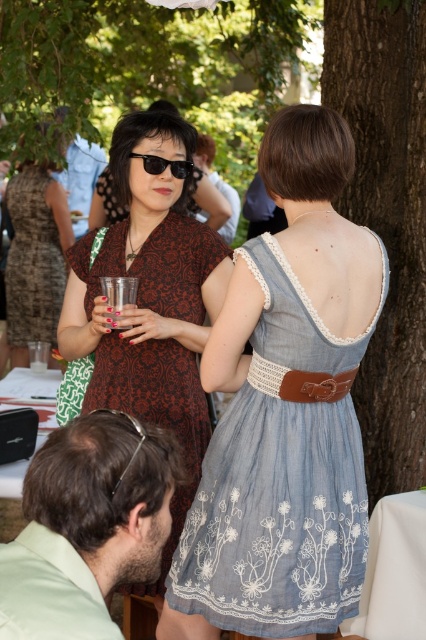
From the picture: Which is above, light green shirt at lower left or clear plastic cup at center?

clear plastic cup at center is above.

In the scene shown: Can you confirm if light green shirt at lower left is positioned to the left of clear plastic cup at center?

In fact, light green shirt at lower left is to the right of clear plastic cup at center.

Does point (100, 598) come farther from viewer compared to point (117, 300)?

No, it is in front of (117, 300).

Identify the location of light green shirt at lower left. (88, 525).

Which is in front, point (54, 189) or point (118, 307)?

Positioned in front is point (118, 307).

Which is more to the right, brown textured dress at center or clear plastic cup at center?

clear plastic cup at center is more to the right.

Who is more distant from viewer, (x=52, y=262) or (x=123, y=324)?

The point (x=52, y=262) is more distant.

This screenshot has height=640, width=426. What are the coordinates of `brown textured dress at center` in the screenshot? It's located at (34, 257).

Which is above, light green shirt at lower left or black plastic sunglasses at upper center?

black plastic sunglasses at upper center

Locate an element on the screen. The image size is (426, 640). light green shirt at lower left is located at coordinates (88, 525).